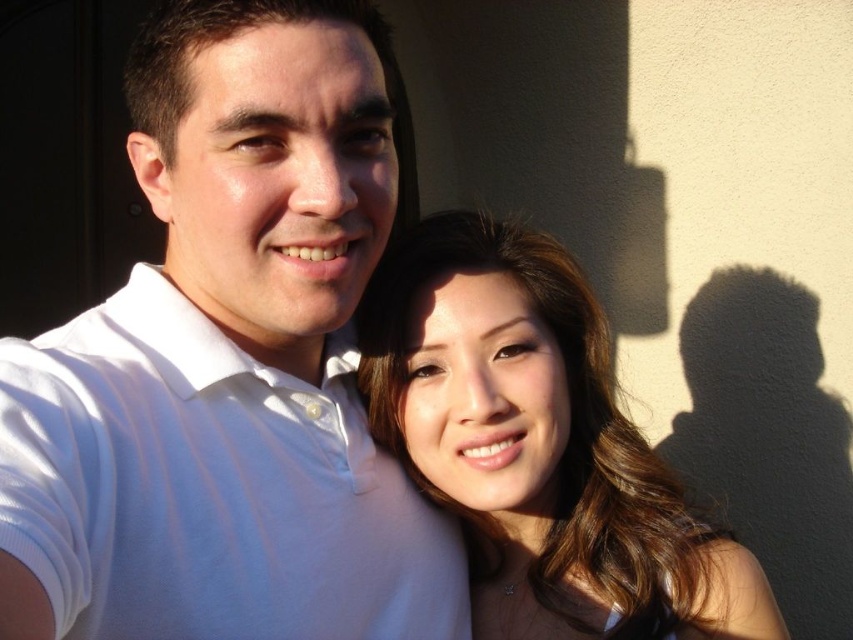
You are standing in front of a wall with two people and a door frame. There is a point at coordinates point (105, 464). If you want to touch this point with a 28 inch long stick, will the stick be long enough?

The distance of point (105, 464) from viewer is 31.16 inches. Since the stick is only 28 inches long, it will not be long enough to reach the point.

You are a photographer trying to capture a closeup of the white smooth shirt at center and the smooth brown hair at center. Which object should you zoom in on first to ensure both are in focus?

The white smooth shirt at center is bigger than the smooth brown hair at center, so you should zoom in on the white smooth shirt at center first to ensure both are in focus.